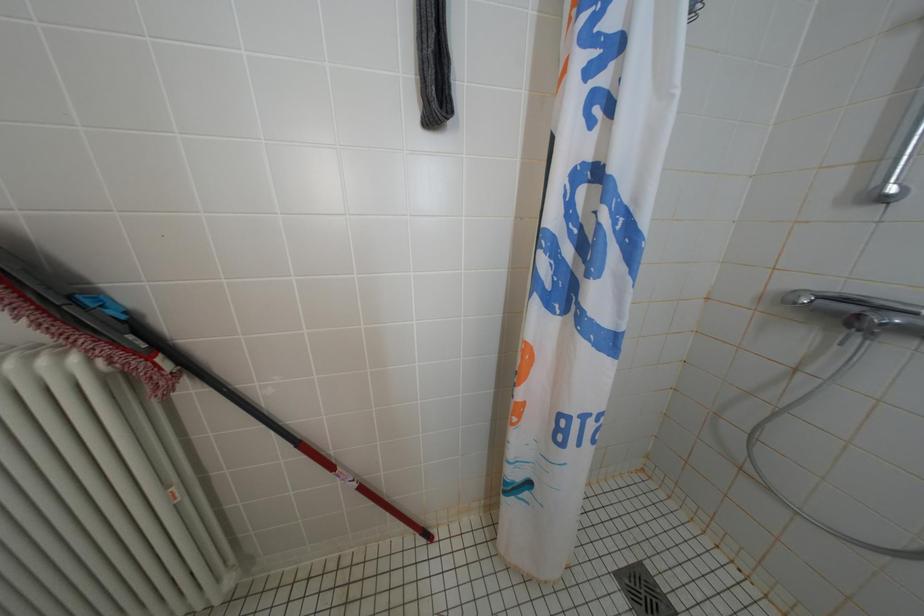
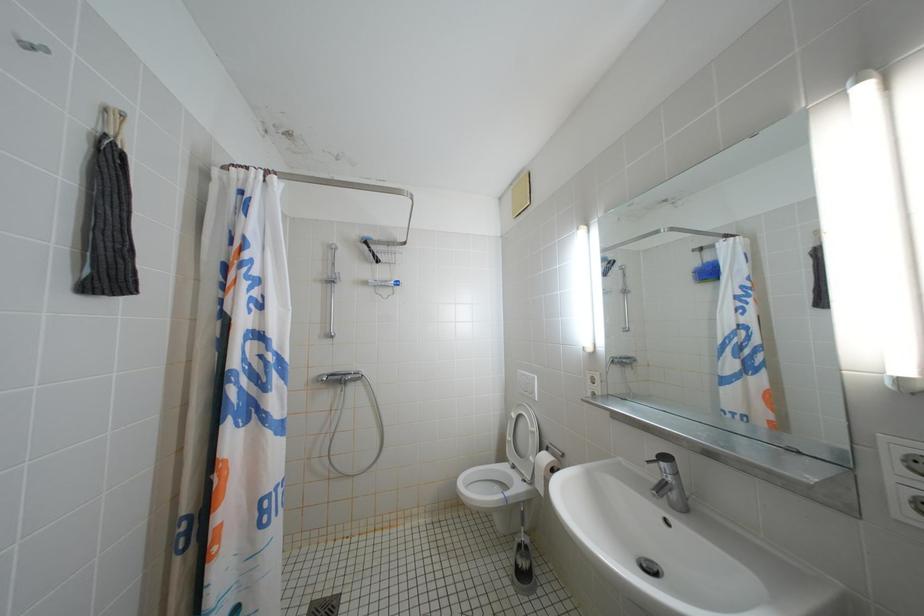
Question: The first image is from the beginning of the video and the second image is from the end. How did the camera likely rotate when shooting the video?

Choices:
 (A) Left
 (B) Right
 (C) Up
 (D) Down

Answer: (B)